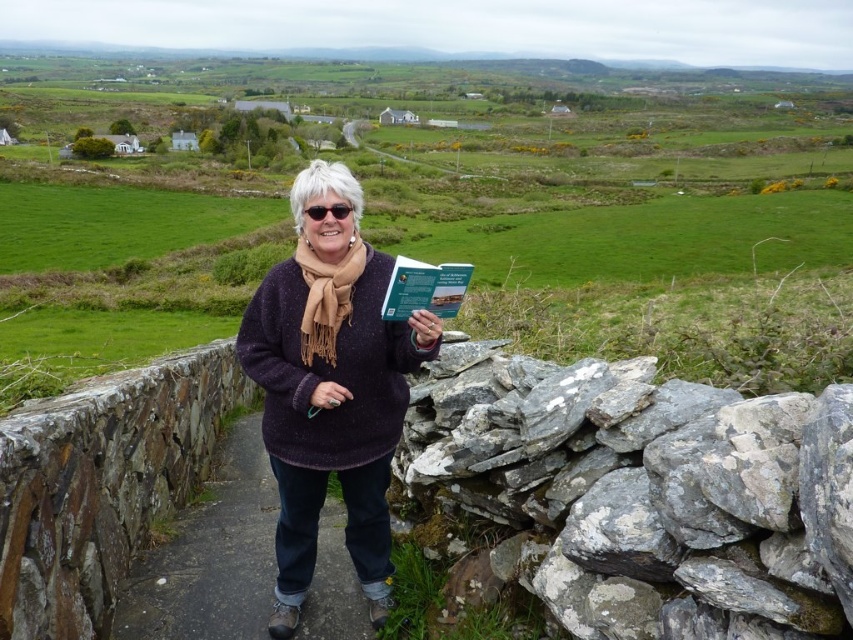
You are a photographer trying to capture a portrait of the person in the purple wool sweater at center and the green matte book at center. You want to ensure both subjects are in focus. Given that your camera can only maintain sharp focus within a 4 feet range, will you be able to achieve this?

The purple wool sweater at center is 4.74 feet from the green matte book at center. Since the distance between them exceeds the camera focus range of 4 feet, you will not be able to have both in focus simultaneously.

You are a photographer trying to capture a clear shot of the green matte book at center while ensuring the purple wool sweater at center is visible in the frame. Based on their positions, can you position yourself so that both are in the same photo?

Yes, since the purple wool sweater at center is to the left of the green matte book at center, you can position yourself to the right of both objects to include both in the same frame.